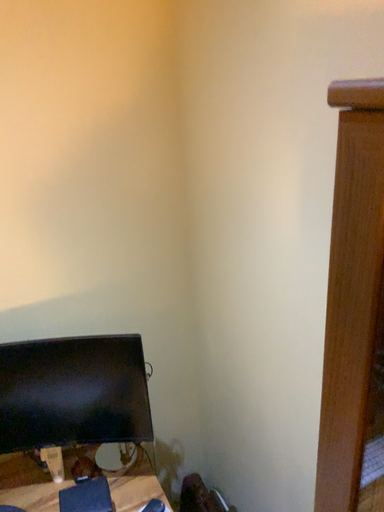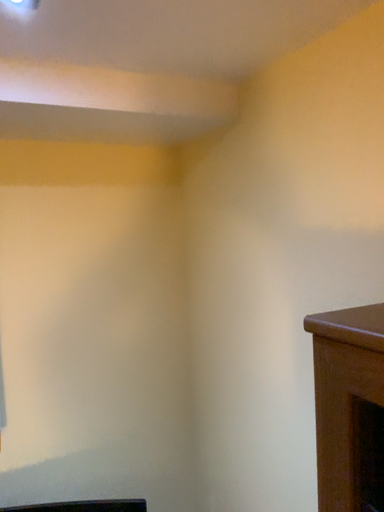
Question: How did the camera likely rotate when shooting the video?

Choices:
 (A) rotated upward
 (B) rotated downward

Answer: (A)